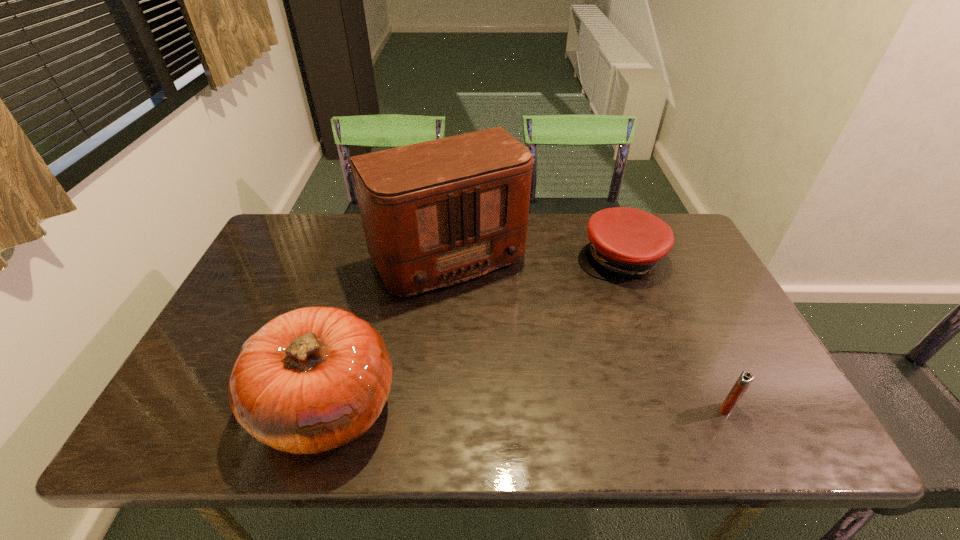
The width and height of the screenshot is (960, 540). Find the location of `blank region between the second tallest object and the igniter`. blank region between the second tallest object and the igniter is located at coordinates 527,407.

Where is `empty space between the second tallest object and the cap`? The width and height of the screenshot is (960, 540). empty space between the second tallest object and the cap is located at coordinates (474, 332).

Locate an element on the screen. unoccupied position between the second tallest object and the tallest object is located at coordinates (384, 331).

The width and height of the screenshot is (960, 540). In order to click on empty location between the cap and the second tallest object in this screenshot , I will do `click(474, 332)`.

Identify the location of free space between the second tallest object and the radio receiver. This screenshot has width=960, height=540. (384, 331).

The height and width of the screenshot is (540, 960). Find the location of `vacant point located between the second tallest object and the igniter`. vacant point located between the second tallest object and the igniter is located at coordinates (527, 407).

Find the location of a particular element. The height and width of the screenshot is (540, 960). object that can be found as the third closest to the third shortest object is located at coordinates (746, 378).

You are a GUI agent. You are given a task and a screenshot of the screen. Output one action in this format:
    pyautogui.click(x=<x>, y=<y>)
    Task: Click on the closest object relative to the pumpkin
    Image resolution: width=960 pixels, height=540 pixels.
    Given the screenshot: What is the action you would take?
    pyautogui.click(x=436, y=213)

Where is `vacant space that satisfies the following two spatial constraints: 1. on the front side of the igniter; 2. on the right side of the third shortest object`? vacant space that satisfies the following two spatial constraints: 1. on the front side of the igniter; 2. on the right side of the third shortest object is located at coordinates (327, 408).

Find the location of a particular element. The image size is (960, 540). vacant point that satisfies the following two spatial constraints: 1. on the back side of the third shortest object; 2. on the left side of the tallest object is located at coordinates (371, 257).